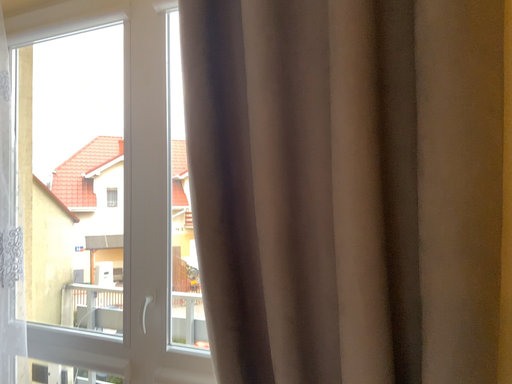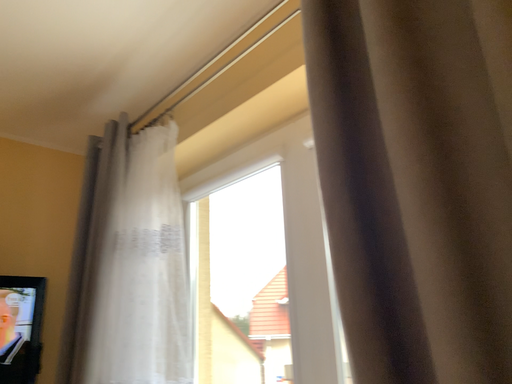
Question: How did the camera likely rotate when shooting the video?

Choices:
 (A) rotated right
 (B) rotated left

Answer: (B)